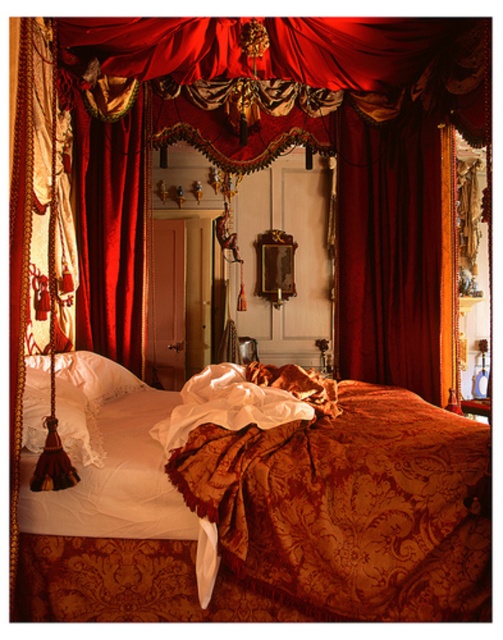
Which of these two, gold damask blanket at center or velvet deep red curtain at center, stands taller?

Standing taller between the two is velvet deep red curtain at center.

Is gold damask blanket at center shorter than velvet deep red curtain at center?

Correct, gold damask blanket at center is not as tall as velvet deep red curtain at center.

At what (x,y) coordinates should I click in order to perform the action: click on gold damask blanket at center. Please return your answer as a coordinate pair (x, y). Looking at the image, I should click on (349, 500).

Locate an element on the screen. Image resolution: width=503 pixels, height=640 pixels. velvet deep red curtain at center is located at coordinates (388, 252).

Is velvet deep red curtain at center behind velvet drapery at left?

Yes, it is.

This screenshot has height=640, width=503. What do you see at coordinates (388, 252) in the screenshot?
I see `velvet deep red curtain at center` at bounding box center [388, 252].

Identify the location of velvet deep red curtain at center. (388, 252).

Is gold damask blanket at center further to camera compared to velvet drapery at left?

No, it is not.

Which is behind, point (302, 465) or point (121, 273)?

The point (121, 273) is behind.

Is point (330, 432) farther from camera compared to point (118, 134)?

No.

Image resolution: width=503 pixels, height=640 pixels. In order to click on gold damask blanket at center in this screenshot , I will do `click(349, 500)`.